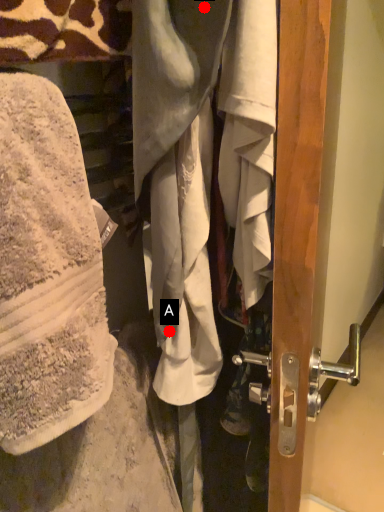
Question: Two points are circled on the image, labeled by A and B beside each circle. Which point is closer to the camera?

Choices:
 (A) A is closer
 (B) B is closer

Answer: (B)